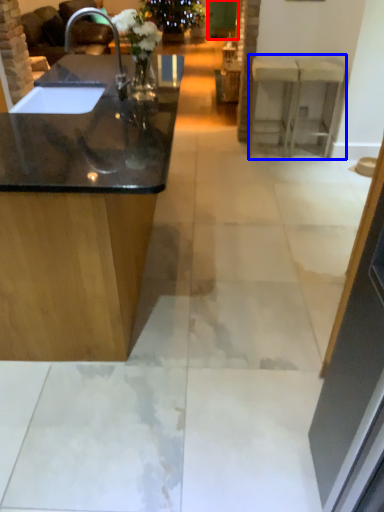
Question: Which object is further to the camera taking this photo, glass door (highlighted by a red box) or counter (highlighted by a blue box)?

Choices:
 (A) glass door
 (B) counter

Answer: (A)